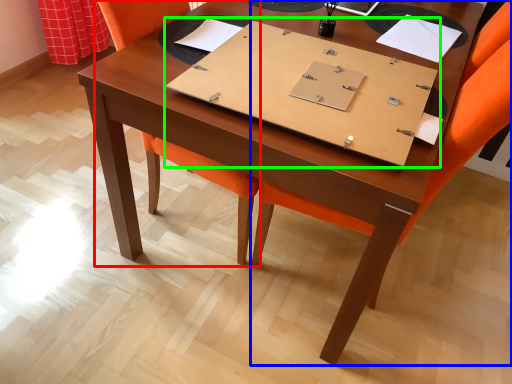
Question: Which object is the farthest from swivel chair (highlighted by a red box)? Choose among these: chair (highlighted by a blue box) or notebook (highlighted by a green box).

Choices:
 (A) chair
 (B) notebook

Answer: (B)